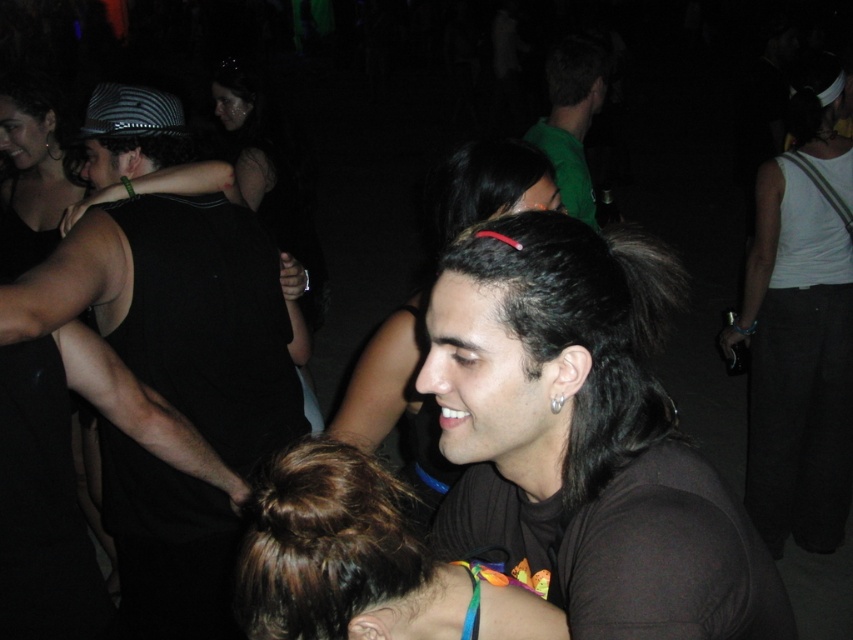
Who is positioned more to the left, dark brown hair at center or black matte hair at center?

black matte hair at center is more to the left.

The height and width of the screenshot is (640, 853). What do you see at coordinates (583, 436) in the screenshot? I see `dark brown hair at center` at bounding box center [583, 436].

Find the location of a particular element. Image resolution: width=853 pixels, height=640 pixels. dark brown hair at center is located at coordinates (583, 436).

This screenshot has width=853, height=640. What do you see at coordinates (183, 312) in the screenshot?
I see `black matte tank top at left` at bounding box center [183, 312].

Is black matte tank top at left shorter than black shiny hair at center?

No.

Between point (251, 355) and point (524, 342), which one is positioned behind?

The point (251, 355) is more distant.

The width and height of the screenshot is (853, 640). In order to click on black matte tank top at left in this screenshot , I will do `click(183, 312)`.

Looking at this image, does brown hair at center have a lesser height compared to matte black tank top at left?

Correct, brown hair at center is not as tall as matte black tank top at left.

From the picture: Is brown hair at center to the left of matte black tank top at left from the viewer's perspective?

Incorrect, brown hair at center is not on the left side of matte black tank top at left.

The height and width of the screenshot is (640, 853). What are the coordinates of `brown hair at center` in the screenshot? It's located at [363, 561].

The height and width of the screenshot is (640, 853). Identify the location of brown hair at center. (363, 561).